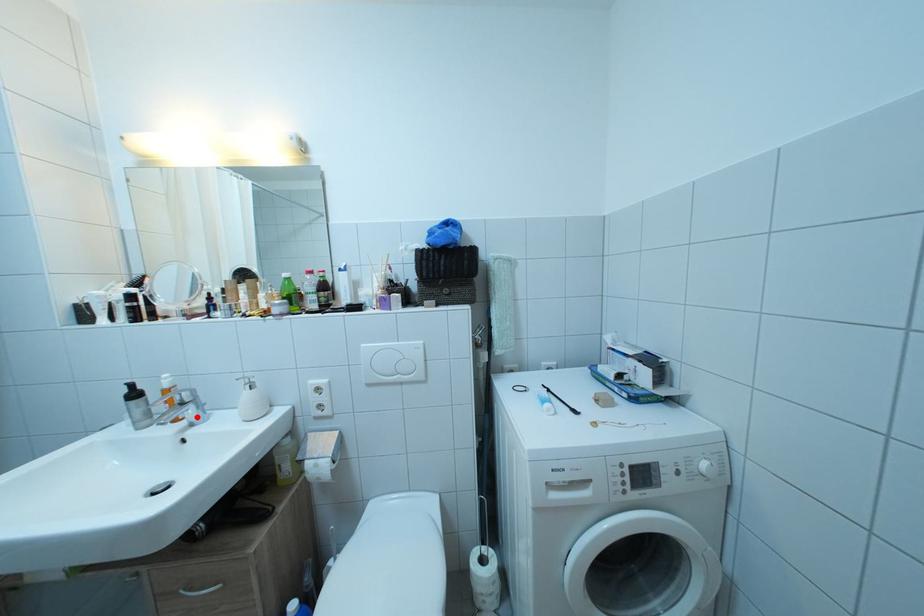
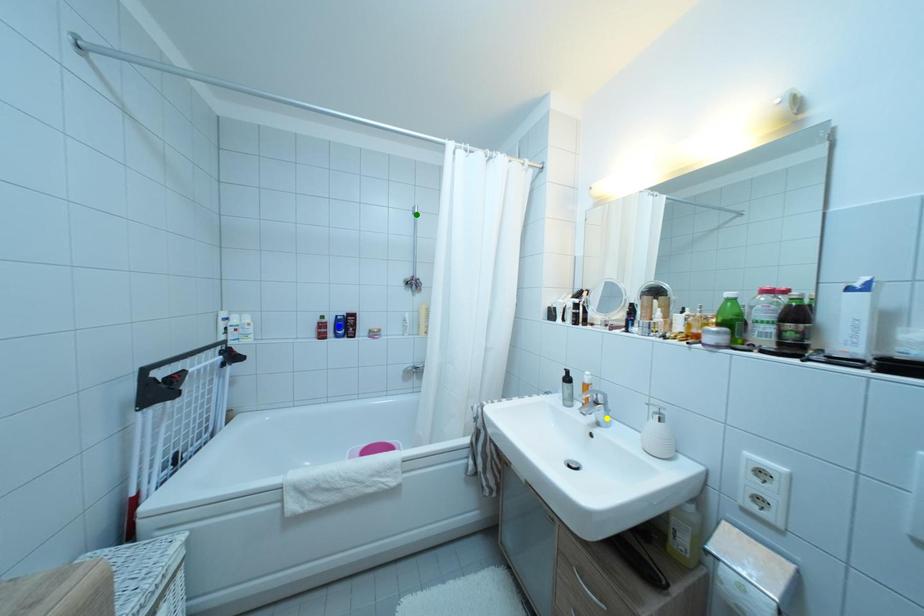
Question: I am providing you with two images of the same scene from different viewpoints. A red point is marked on the first image. You are given multiple points on the second image. Which point in image 2 is actually the same real-world point as the red point in image 1?

Choices:
 (A) green point
 (B) yellow point
 (C) blue point

Answer: (B)